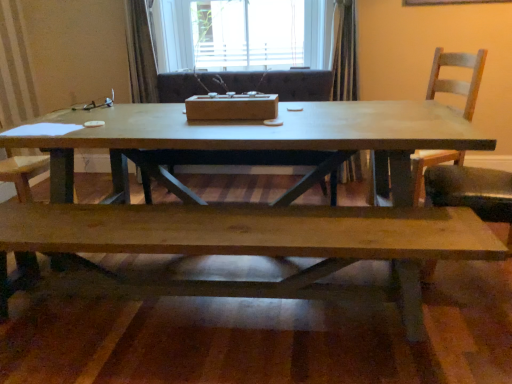
Question: Looking at the image, does wooden chair at right seem bigger or smaller compared to white wood window at upper center?

Choices:
 (A) big
 (B) small

Answer: (B)

Question: Is wooden chair at right situated inside white wood window at upper center or outside?

Choices:
 (A) inside
 (B) outside

Answer: (B)

Question: Which object is the farthest from the matte wood coffee table at center?

Choices:
 (A) wooden armchair at center
 (B) white wood window at upper center
 (C) wooden chair at right
 (D) natural wood bench at lower center

Answer: (B)

Question: Considering the real-world distances, which object is closest to the natural wood bench at lower center?

Choices:
 (A) wooden chair at right
 (B) matte wood coffee table at center
 (C) wooden armchair at center
 (D) white wood window at upper center

Answer: (B)